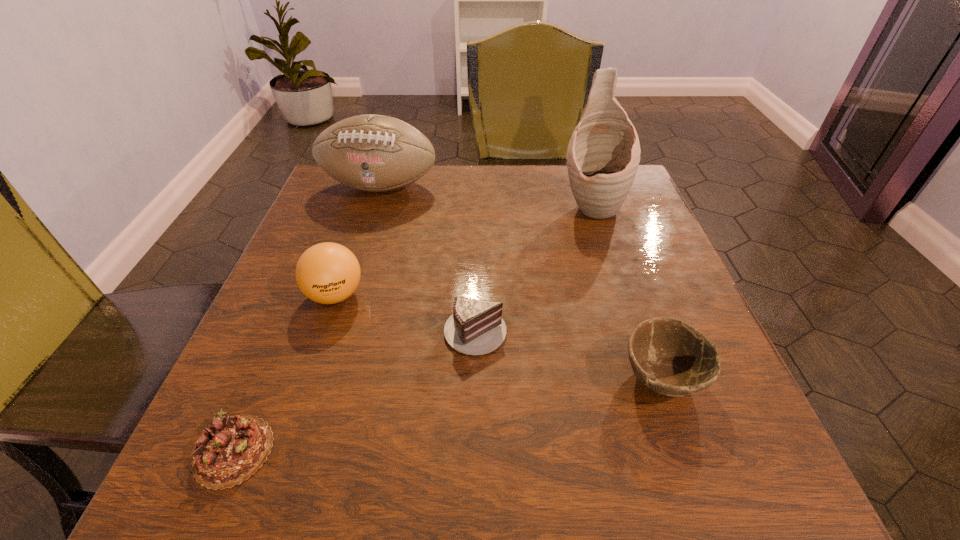
Find the location of a particular element. pitcher positioned at the right edge is located at coordinates (603, 155).

What are the coordinates of `bowl at the right edge` in the screenshot? It's located at (669, 356).

Locate an element on the screen. object located at the far left corner is located at coordinates (375, 153).

Identify the location of object located at the near left corner. (229, 451).

You are a GUI agent. You are given a task and a screenshot of the screen. Output one action in this format:
    pyautogui.click(x=<x>, y=<y>)
    Task: Click on the object located at the far right corner
    This screenshot has width=960, height=540.
    Given the screenshot: What is the action you would take?
    pyautogui.click(x=603, y=155)

Image resolution: width=960 pixels, height=540 pixels. Identify the location of vacant region at the far edge of the desktop. (493, 193).

The height and width of the screenshot is (540, 960). In the image, there is a desktop. Find the location of `free space at the left edge`. free space at the left edge is located at coordinates (294, 375).

Find the location of `vacant space at the right edge`. vacant space at the right edge is located at coordinates (624, 218).

I want to click on blank space at the far left corner, so click(x=348, y=218).

The height and width of the screenshot is (540, 960). I want to click on vacant area at the near left corner, so click(274, 461).